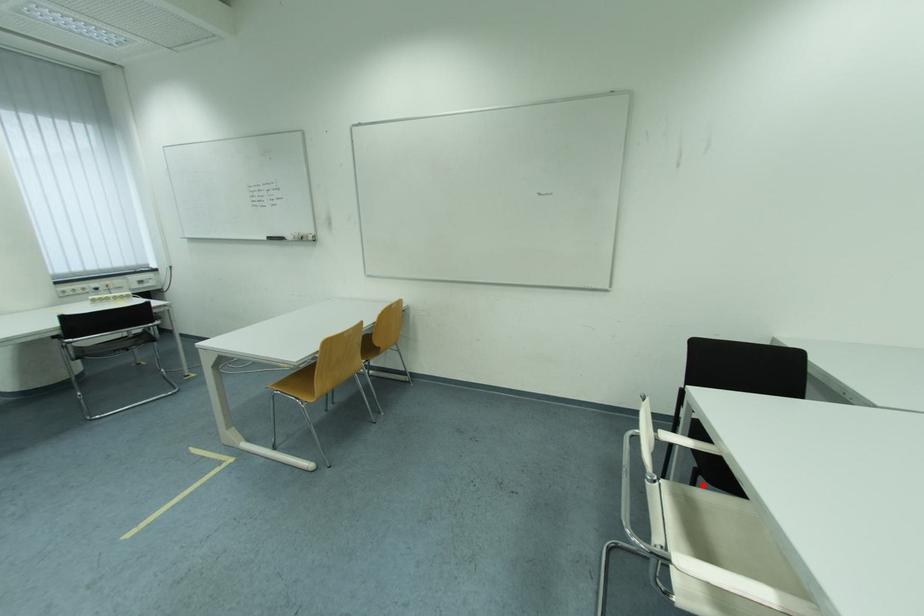
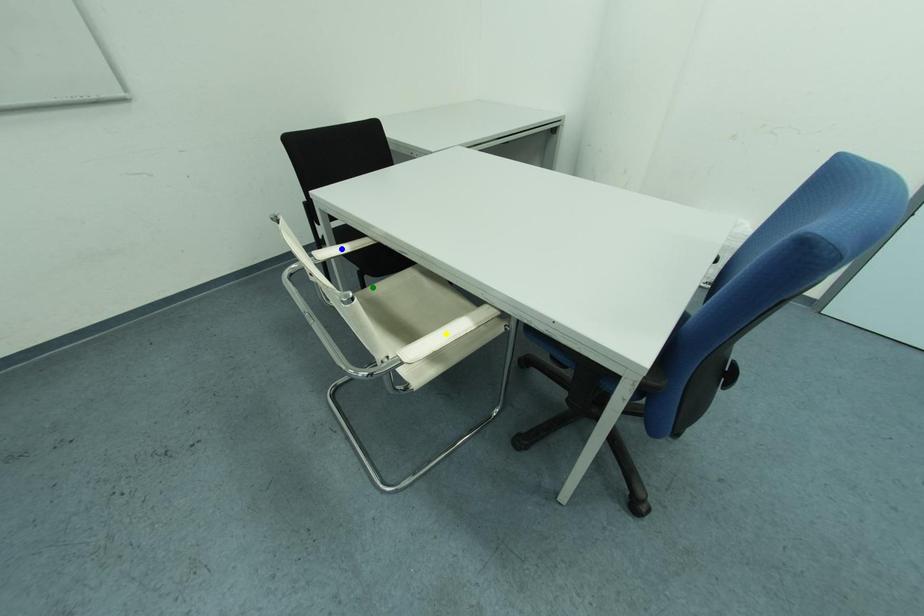
Question: I am providing you with two images of the same scene from different viewpoints. A red point is marked on the first image. You are given multiple points on the second image. Which point in image 2 is actually the same real-world point as the red point in image 1?

Choices:
 (A) yellow point
 (B) blue point
 (C) green point

Answer: (C)